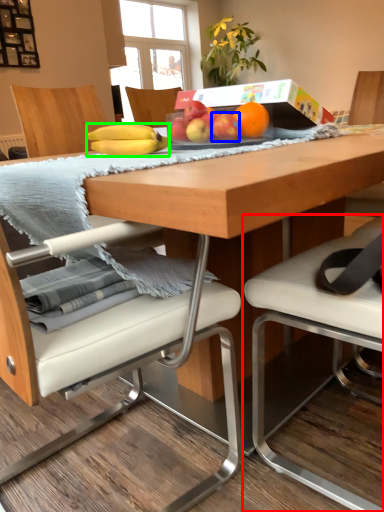
Question: Estimate the real-world distances between objects in this image. Which object is closer to chair (highlighted by a red box), apple (highlighted by a blue box) or banana (highlighted by a green box)?

Choices:
 (A) apple
 (B) banana

Answer: (B)